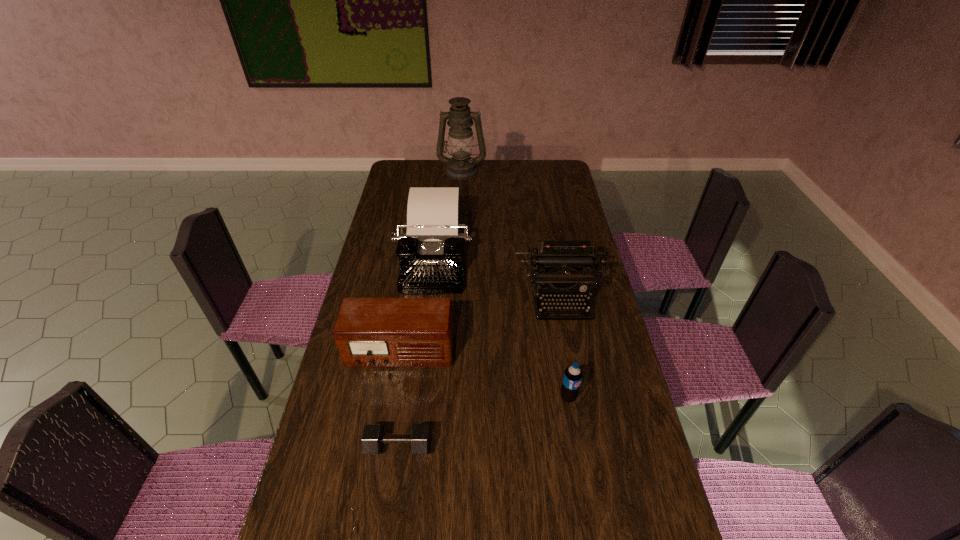
Find the location of `free point located 0.370m on the keyboard of the right typewriter`. free point located 0.370m on the keyboard of the right typewriter is located at coordinates (583, 428).

Identify the location of vacant space located on the front-facing side of the fourth farthest object. This screenshot has width=960, height=540. tap(393, 400).

Image resolution: width=960 pixels, height=540 pixels. I want to click on free space located on the left of the fifth farthest object, so click(x=461, y=397).

Locate an element on the screen. This screenshot has width=960, height=540. vacant region located 0.050m on the left of the dumbbell is located at coordinates (348, 446).

What are the coordinates of `object positioned at the far edge` in the screenshot? It's located at (461, 166).

Find the location of `typewriter present at the left edge`. typewriter present at the left edge is located at coordinates click(x=431, y=254).

Where is `radio receiver located in the left edge section of the desktop`? The width and height of the screenshot is (960, 540). radio receiver located in the left edge section of the desktop is located at coordinates (369, 332).

Identify the location of dumbbell at the left edge. Image resolution: width=960 pixels, height=540 pixels. (373, 438).

In order to click on typewriter situated at the right edge in this screenshot , I will do `click(560, 262)`.

The height and width of the screenshot is (540, 960). What are the coordinates of `soda bottle that is at the right edge` in the screenshot? It's located at (572, 378).